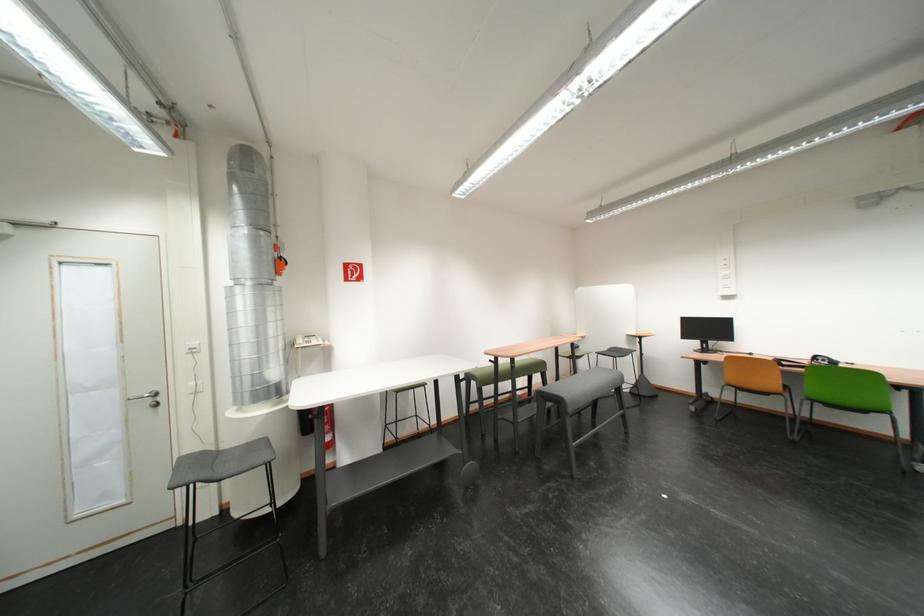
Where would you sit the gray bench sitting surface? Please return your answer as a coordinate pair (x, y).

(505, 371)